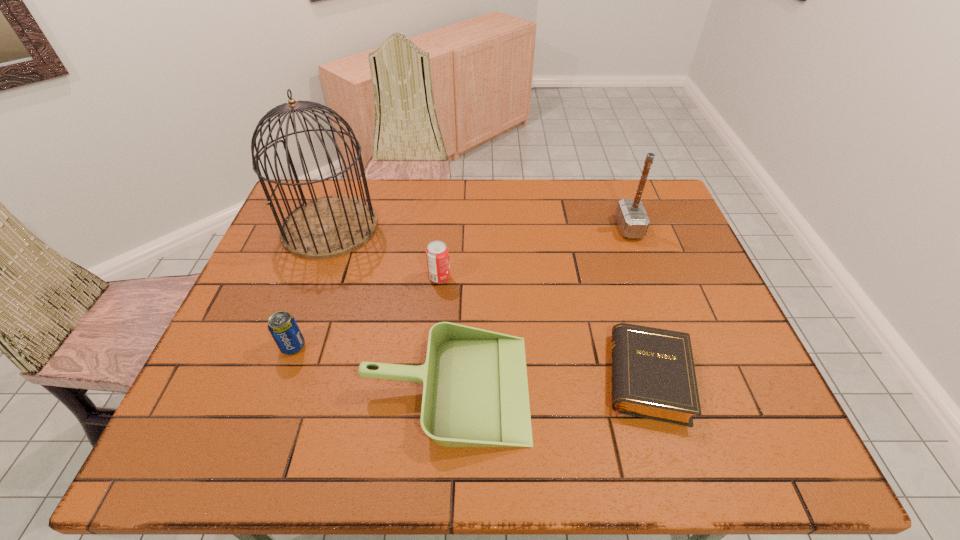
Find the location of `soda present at the left edge`. soda present at the left edge is located at coordinates (283, 327).

Locate an element on the screen. hammer located in the right edge section of the desktop is located at coordinates (632, 219).

Image resolution: width=960 pixels, height=540 pixels. Identify the location of Bible that is at the right edge. (653, 376).

The image size is (960, 540). I want to click on object positioned at the far left corner, so click(x=331, y=226).

The height and width of the screenshot is (540, 960). Identify the location of object at the far right corner. pyautogui.click(x=632, y=219).

You are a GUI agent. You are given a task and a screenshot of the screen. Output one action in this format:
    pyautogui.click(x=<x>, y=<y>)
    Task: Click on the object that is at the near right corner
    
    Given the screenshot: What is the action you would take?
    pyautogui.click(x=653, y=376)

The height and width of the screenshot is (540, 960). In the image, there is a desktop. Find the location of `vacant area at the far edge`. vacant area at the far edge is located at coordinates (392, 205).

At what (x,y) coordinates should I click in order to perform the action: click on vacant space at the near edge of the desktop. Please return your answer as a coordinate pair (x, y). Looking at the image, I should click on (321, 458).

Locate an element on the screen. Image resolution: width=960 pixels, height=540 pixels. vacant region at the left edge is located at coordinates (247, 321).

Locate an element on the screen. The width and height of the screenshot is (960, 540). free location at the right edge is located at coordinates (736, 383).